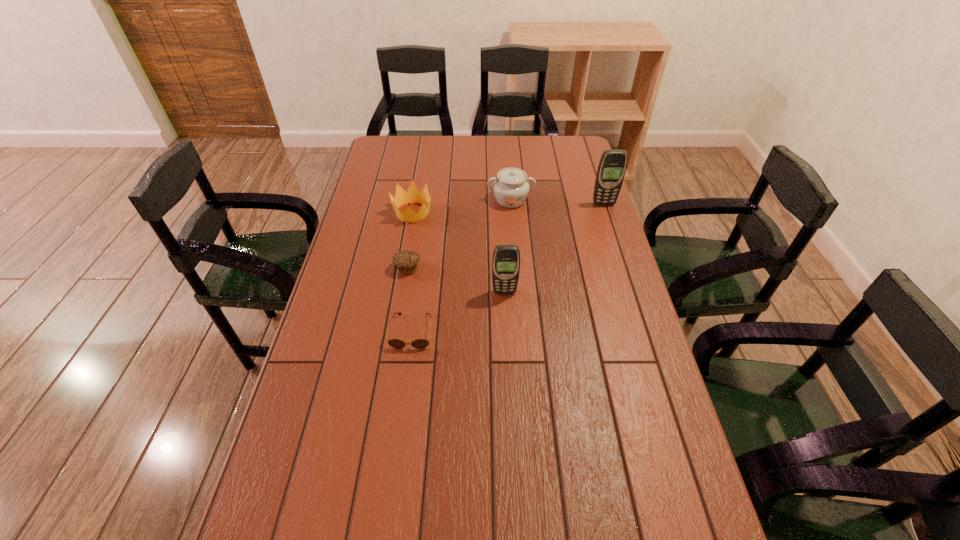
Please point out where to position a new cellular telephone on the left to maintain spacing. Please provide its 2D coordinates. Your answer should be formatted as a tuple, i.e. [(x, y)], where the tuple contains the x and y coordinates of a point satisfying the conditions above.

[(347, 432)]